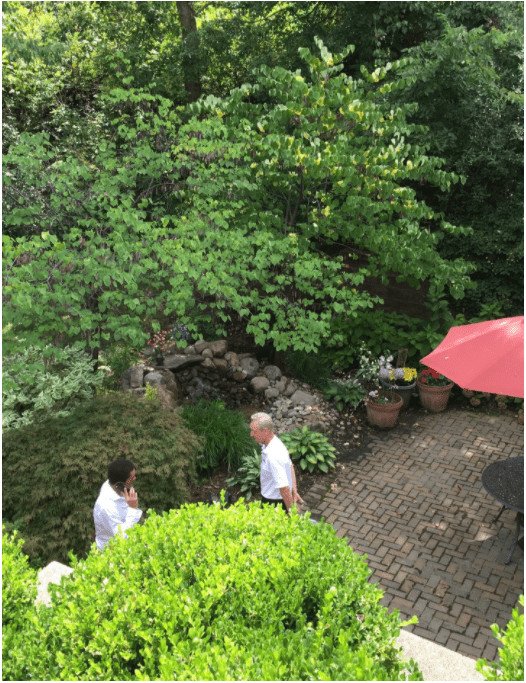
Find the location of a particular element. The height and width of the screenshot is (683, 526). table is located at coordinates (495, 490).